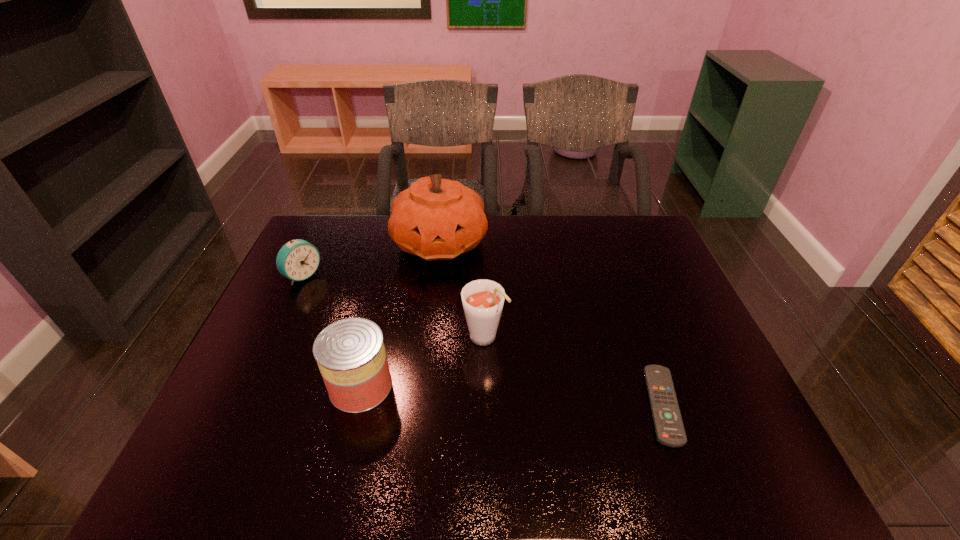
Find the location of a particular element. vacant space situated on the front-facing side of the tallest object is located at coordinates (487, 322).

This screenshot has width=960, height=540. In order to click on vacant space located on the front-facing side of the tallest object in this screenshot , I will do `click(499, 343)`.

You are a GUI agent. You are given a task and a screenshot of the screen. Output one action in this format:
    pyautogui.click(x=<x>, y=<y>)
    Task: Click on the vacant point located 0.050m on the front-facing side of the tallest object
    
    Given the screenshot: What is the action you would take?
    pyautogui.click(x=463, y=280)

What are the coordinates of `free location located on the front-facing side of the alarm clock` in the screenshot? It's located at (324, 292).

At what (x,y) coordinates should I click in order to perform the action: click on vacant area situated 0.060m on the front-facing side of the alarm clock. Please return your answer as a coordinate pair (x, y). The height and width of the screenshot is (540, 960). Looking at the image, I should click on (325, 293).

Locate an element on the screen. The height and width of the screenshot is (540, 960). vacant space located on the front-facing side of the alarm clock is located at coordinates (385, 335).

Locate an element on the screen. The image size is (960, 540). vacant space positioned 0.220m on the drink side of the third farthest object is located at coordinates pyautogui.click(x=546, y=422).

Where is `vacant area situated on the drink side of the third farthest object`? The image size is (960, 540). vacant area situated on the drink side of the third farthest object is located at coordinates (541, 415).

The height and width of the screenshot is (540, 960). In order to click on free spot located on the drink side of the third farthest object in this screenshot , I will do `click(552, 429)`.

Identify the location of object that is at the far edge. (437, 219).